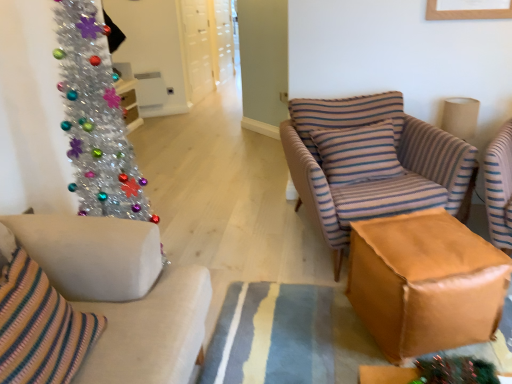
The image size is (512, 384). Identify the location of vacant space situated above brown leather ottoman at center (from a real-world perspective). (423, 243).